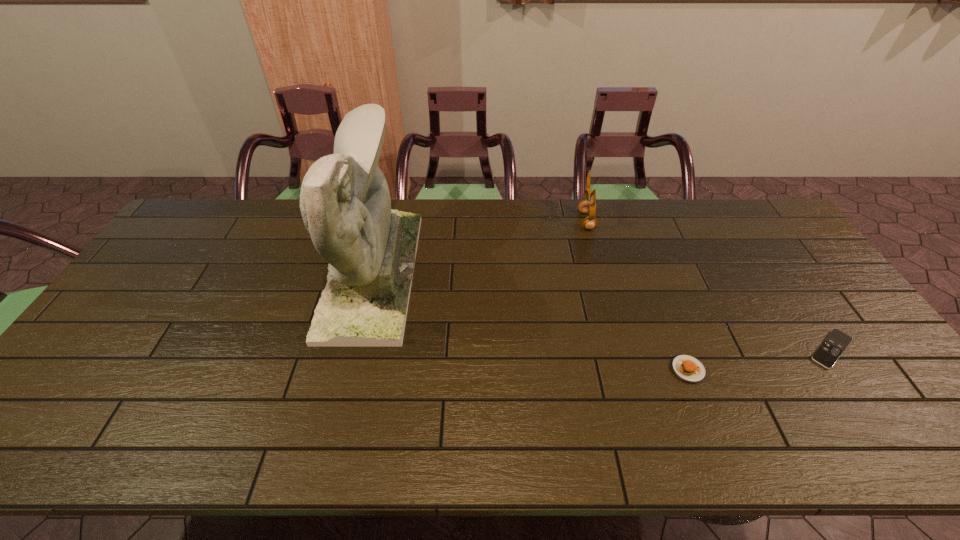
Where is `free region located on the front-facing side of the second tallest object`? The image size is (960, 540). free region located on the front-facing side of the second tallest object is located at coordinates (546, 221).

You are a GUI agent. You are given a task and a screenshot of the screen. Output one action in this format:
    pyautogui.click(x=<x>, y=<y>)
    Task: Click on the vacant space positioned on the front-facing side of the second tallest object
    The width and height of the screenshot is (960, 540).
    Given the screenshot: What is the action you would take?
    pyautogui.click(x=463, y=221)

The height and width of the screenshot is (540, 960). In order to click on free space located 0.070m on the front of the second shortest object in this screenshot , I will do `click(704, 410)`.

Locate an element on the screen. vacant space located 0.240m on the back of the shortest object is located at coordinates (777, 269).

You are a GUI agent. You are given a task and a screenshot of the screen. Output one action in this format:
    pyautogui.click(x=<x>, y=<y>)
    Task: Click on the sculpture that is at the far edge
    Image resolution: width=960 pixels, height=540 pixels.
    Given the screenshot: What is the action you would take?
    pyautogui.click(x=345, y=203)

Identify the location of earphone that is at the far edge. (585, 206).

You are a GUI agent. You are given a task and a screenshot of the screen. Output one action in this format:
    pyautogui.click(x=<x>, y=<y>)
    Task: Click on the object that is at the right edge
    Image resolution: width=960 pixels, height=540 pixels.
    Given the screenshot: What is the action you would take?
    pyautogui.click(x=834, y=345)

The image size is (960, 540). I want to click on vacant space at the far edge, so click(x=666, y=208).

At what (x,y) coordinates should I click in order to perform the action: click on vacant space at the near edge of the desktop. Please return your answer as a coordinate pair (x, y). The image size is (960, 540). Looking at the image, I should click on (352, 438).

This screenshot has height=540, width=960. Identify the location of vacant space at the right edge of the desktop. (842, 388).